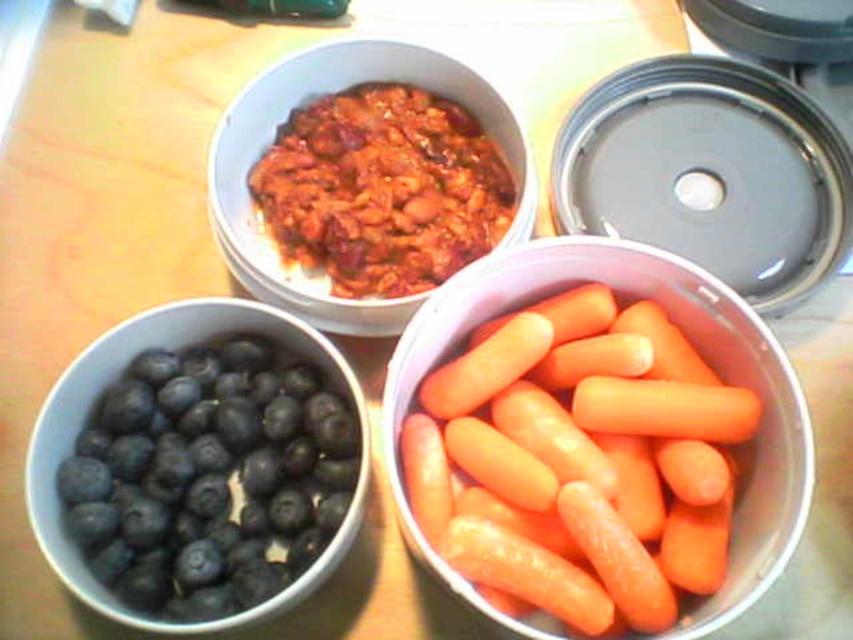
Question: Observing the image, what is the correct spatial positioning of orange glossy carrots at center in reference to matte ceramic chili at upper center?

Choices:
 (A) below
 (B) above

Answer: (A)

Question: Which of the following is the farthest from the observer?

Choices:
 (A) (154, 481)
 (B) (761, 577)
 (C) (260, 93)

Answer: (C)

Question: Which of the following is the farthest from the observer?

Choices:
 (A) (560, 253)
 (B) (294, 483)
 (C) (367, 324)

Answer: (C)

Question: In this image, where is blue matte/blackberry at lower left located relative to matte ceramic chili at upper center?

Choices:
 (A) right
 (B) left

Answer: (B)

Question: Does orange glossy carrots at center have a lesser width compared to matte ceramic chili at upper center?

Choices:
 (A) yes
 (B) no

Answer: (A)

Question: Which point appears closest to the camera in this image?

Choices:
 (A) (242, 188)
 (B) (793, 396)
 (C) (125, 380)

Answer: (B)